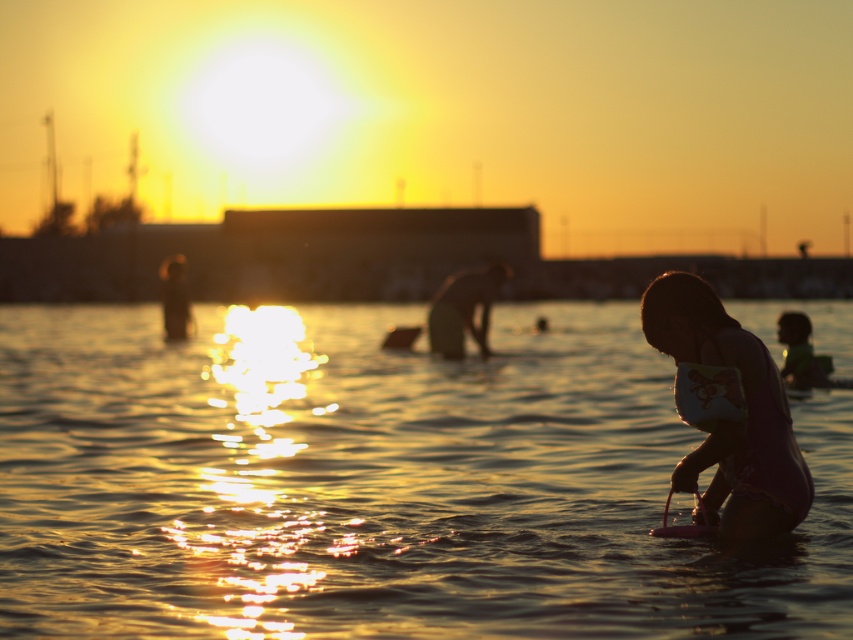
Does pink matte swimsuit at lower right appear under smooth skin person at center?

Yes, pink matte swimsuit at lower right is below smooth skin person at center.

Does pink matte swimsuit at lower right have a larger size compared to smooth skin person at center?

Actually, pink matte swimsuit at lower right might be smaller than smooth skin person at center.

Measure the distance between pink matte swimsuit at lower right and camera.

A distance of 6.69 meters exists between pink matte swimsuit at lower right and camera.

Identify the location of pink matte swimsuit at lower right. The height and width of the screenshot is (640, 853). click(x=730, y=420).

Is translucent golden water at center wider than smooth skin person at center?

Correct, the width of translucent golden water at center exceeds that of smooth skin person at center.

Who is more forward, (x=764, y=572) or (x=489, y=282)?

Positioned in front is point (x=764, y=572).

Who is more forward, (523, 512) or (485, 291)?

Point (523, 512)

Locate an element on the screen. The image size is (853, 640). translucent golden water at center is located at coordinates (383, 488).

Who is taller, translucent golden water at center or silhouette human at left?

silhouette human at left is taller.

Image resolution: width=853 pixels, height=640 pixels. I want to click on translucent golden water at center, so click(x=383, y=488).

Which is in front, point (158, 397) or point (166, 305)?

Point (158, 397) is in front.

Identify the location of translucent golden water at center. (383, 488).